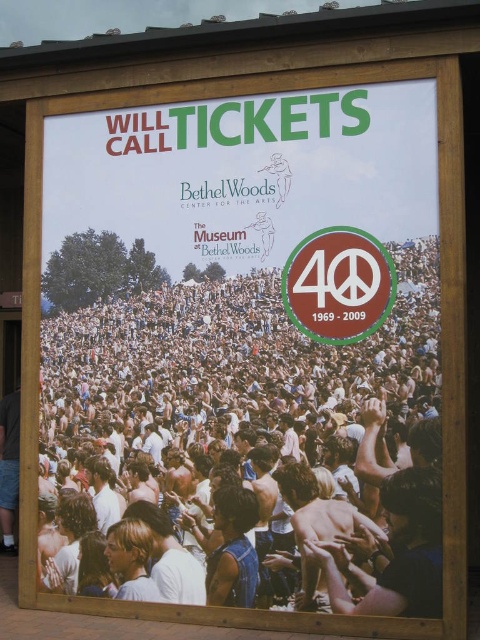
You are standing in front of the signboard and want to know which object is taller between the matte white signboard at center and the matte brown peace sign at center. Can you determine this?

The matte white signboard at center is taller than the matte brown peace sign at center according to the description.

You are standing in front of the entrance of the building and see the matte white signboard at center and the matte brown peace sign at center. Which one is positioned more to the left side?

The matte white signboard at center is positioned more to the left side than the matte brown peace sign at center.

You are standing in front of the signboard and want to read the information on it. Is the white cotton crowd at center blocking your view of the matte white signboard at center?

The white cotton crowd at center is closer to the viewer than the matte white signboard at center, so the crowd is blocking the view of the signboard.